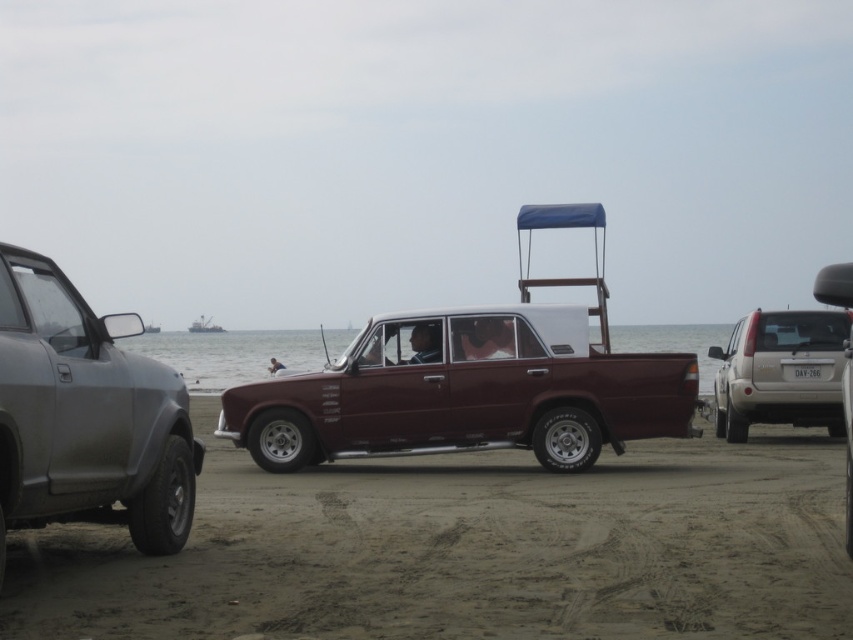
You are a driver trying to park your car in a tight space between the matte gray suv at left and the metallic gray boat at left. Can you estimate if there is enough space between them for your car, which is 4.5 meters long?

The matte gray suv at left is smaller than the metallic gray boat at left, but without specific measurements of the distance between them, it is impossible to determine if there is enough space for a 4.5 meter car. Please check the actual distance or consult the parking guidelines.

You are a photographer setting up a tripod to capture the matte gray suv at left and the metallic gray boat at left. You want to ensure both are fully visible in the frame. Which object should you position closer to the camera to avoid cropping?

You should position the matte gray suv at left closer to the camera because it is taller than the metallic gray boat at left, so it requires more vertical space in the frame to avoid cropping.

You are a delivery person needing to transport a large package that requires a vehicle with more space. Based on the scene, which vehicle between the silver metallic suv at right and the metallic gray boat at center would you choose?

The silver metallic suv at right has a larger size compared to the metallic gray boat at center, so it would provide more space for transporting the large package.